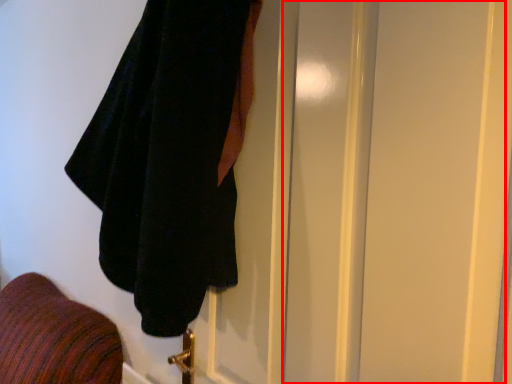
Question: From the image, what is the correct spatial relationship of screen door (annotated by the red box) in relation to towel?

Choices:
 (A) left
 (B) right

Answer: (B)